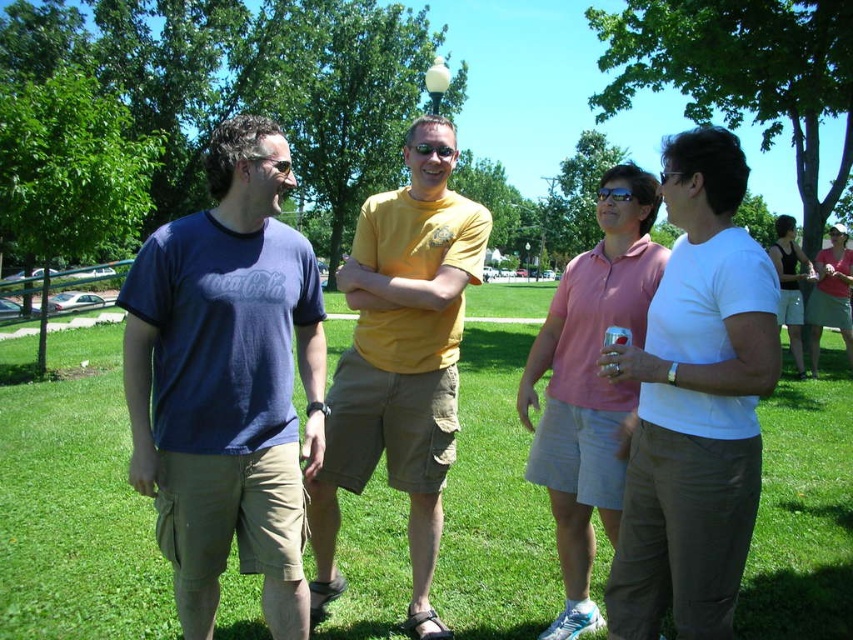
Can you confirm if matte blue t-shirt at center is positioned below pink cotton polo shirt at center?

No.

Which is more to the right, matte blue t-shirt at center or pink cotton polo shirt at center?

From the viewer's perspective, pink cotton polo shirt at center appears more on the right side.

Where is `matte blue t-shirt at center`? The width and height of the screenshot is (853, 640). matte blue t-shirt at center is located at coordinates (227, 381).

Does point (676, 481) come in front of point (579, 260)?

Yes, point (676, 481) is closer to viewer.

This screenshot has height=640, width=853. Describe the element at coordinates (695, 404) in the screenshot. I see `white matte shirt at center` at that location.

At what (x,y) coordinates should I click in order to perform the action: click on white matte shirt at center. Please return your answer as a coordinate pair (x, y). Looking at the image, I should click on pos(695,404).

Locate an element on the screen. This screenshot has height=640, width=853. white matte shirt at center is located at coordinates (695, 404).

Is point (650, 493) closer to camera compared to point (409, 195)?

Yes, point (650, 493) is in front of point (409, 195).

Is point (664, 381) positioned after point (398, 204)?

No, it is in front of (398, 204).

Identify the location of white matte shirt at center. (695, 404).